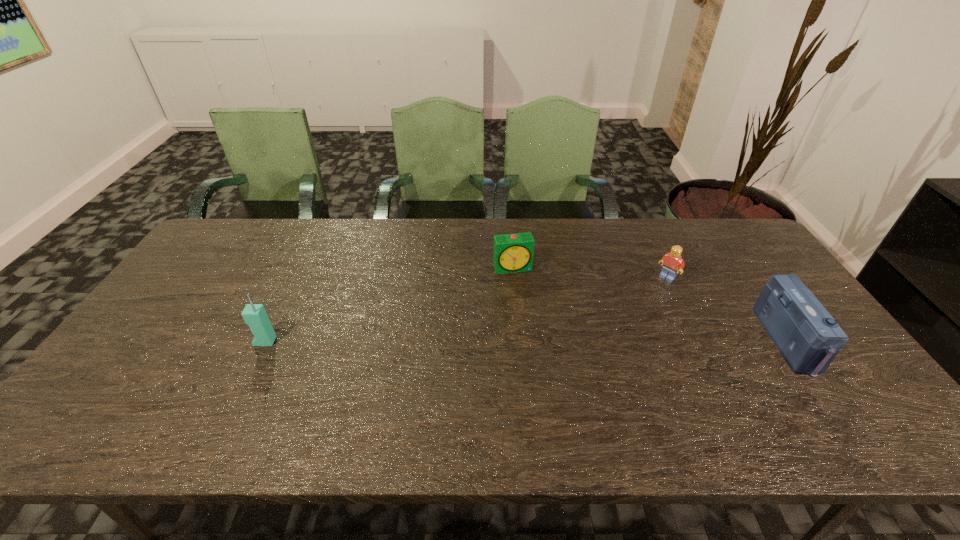
You are a GUI agent. You are given a task and a screenshot of the screen. Output one action in this format:
    pyautogui.click(x=<x>, y=<y>)
    Task: Click on the vacant space at the left edge of the desktop
    The image size is (960, 540).
    Given the screenshot: What is the action you would take?
    pyautogui.click(x=215, y=298)

I want to click on free location at the right edge, so click(x=762, y=269).

Locate an element on the screen. blank area at the far left corner is located at coordinates (225, 244).

Identify the location of free space between the Lego and the third object from right to left. (590, 273).

Identify the location of unoccupied position between the Lego and the cellular telephone. This screenshot has width=960, height=540. [466, 309].

At what (x,y) coordinates should I click in order to perform the action: click on free area in between the rightmost object and the tallest object. Please return your answer as a coordinate pair (x, y). This screenshot has height=540, width=960. Looking at the image, I should click on (527, 341).

Find the location of a particular element. This screenshot has height=540, width=960. free area in between the third object from right to left and the rightmost object is located at coordinates (651, 305).

Find the location of a particular element. Image resolution: width=960 pixels, height=540 pixels. free space between the tallest object and the second object from right to left is located at coordinates (466, 309).

Locate an element on the screen. vacant region between the third object from left to right and the rightmost object is located at coordinates (728, 309).

Where is `empty space that is in between the alarm clock and the camera`? empty space that is in between the alarm clock and the camera is located at coordinates (651, 305).